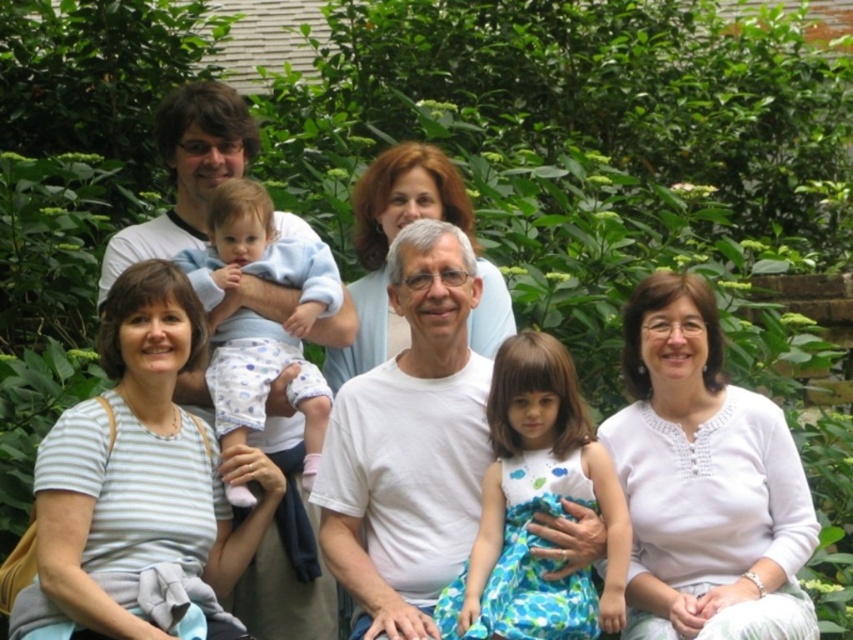
You are a photographer trying to adjust the focus on your camera. You notice two white tops at the center of the image. Which one is closer to the camera, the white textured blouse at center or the white cotton shirt at center?

The white textured blouse at center is shorter than the white cotton shirt at center, so it is closer to the camera.

You are a photographer setting up a shot for this family photo. You need to ensure that both the white striped shirt at lower left and the white textured blouse at center are visible in the frame. Which clothing item should you adjust your camera angle to prioritize if the frame can only accommodate one of them due to space constraints?

The white striped shirt at lower left is wider than the white textured blouse at center. Therefore, to prioritize the larger item, adjust the camera angle to ensure the white striped shirt at lower left is fully visible in the frame.

You are a photographer trying to adjust the composition of this family photo. You notice the white striped shirt at lower left and the white textured blouse at center. Which clothing item should you move to balance the height difference between them?

The white striped shirt at lower left is shorter than the white textured blouse at center. To balance the height difference, move the white striped shirt at lower left upwards so it aligns with the height of the white textured blouse at center.